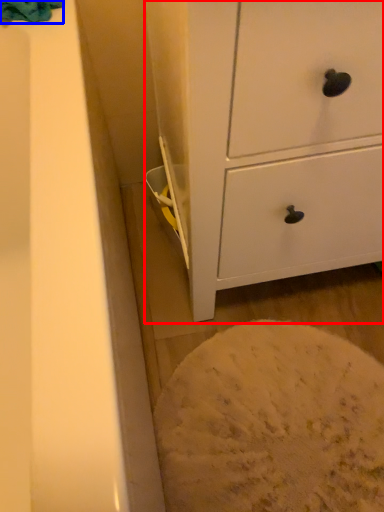
Question: Which object is closer to the camera taking this photo, chest of drawers (highlighted by a red box) or bath towel (highlighted by a blue box)?

Choices:
 (A) chest of drawers
 (B) bath towel

Answer: (A)